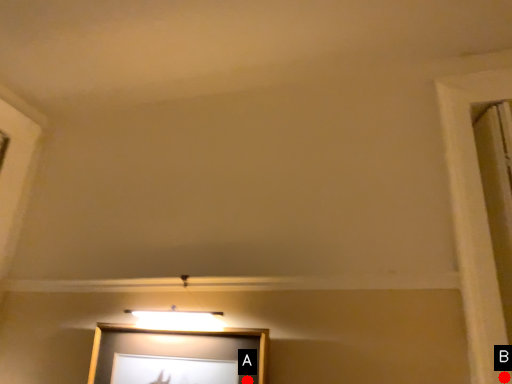
Question: Two points are circled on the image, labeled by A and B beside each circle. Among these points, which one is farthest from the camera?

Choices:
 (A) A is further
 (B) B is further

Answer: (A)